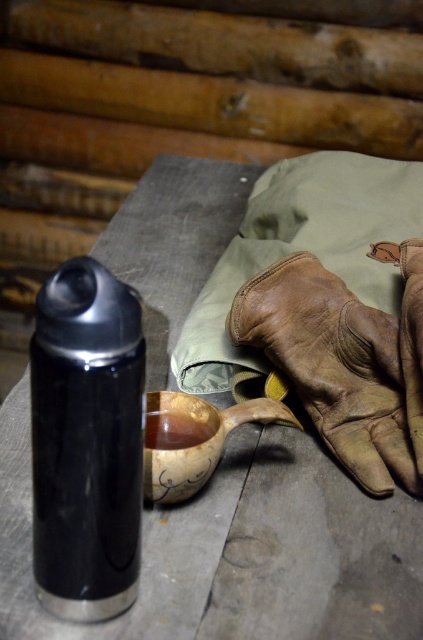
Does green canvas cloth at upper right appear on the right side of brown wooden bowl at center?

Indeed, green canvas cloth at upper right is positioned on the right side of brown wooden bowl at center.

Where is `green canvas cloth at upper right`? green canvas cloth at upper right is located at coordinates (302, 248).

Describe the element at coordinates (302, 248) in the screenshot. The height and width of the screenshot is (640, 423). I see `green canvas cloth at upper right` at that location.

Find the location of `green canvas cloth at upper right`. green canvas cloth at upper right is located at coordinates (302, 248).

Can you confirm if brown leather glove at center is thinner than wooden carved cup at center?

No.

Which is behind, point (332, 291) or point (181, 486)?

Point (332, 291)

Which is in front, point (337, 291) or point (180, 484)?

Point (180, 484) is in front.

Where is `brown leather glove at center`? Image resolution: width=423 pixels, height=640 pixels. brown leather glove at center is located at coordinates (345, 362).

Is point (98, 300) less distant than point (365, 205)?

That is True.

Who is taller, shiny metallic bottle at center or green canvas cloth at upper right?

Standing taller between the two is green canvas cloth at upper right.

Who is more forward, (76, 525) or (238, 268)?

Point (76, 525)

Locate an element on the screen. Image resolution: width=423 pixels, height=640 pixels. shiny metallic bottle at center is located at coordinates (87, 442).